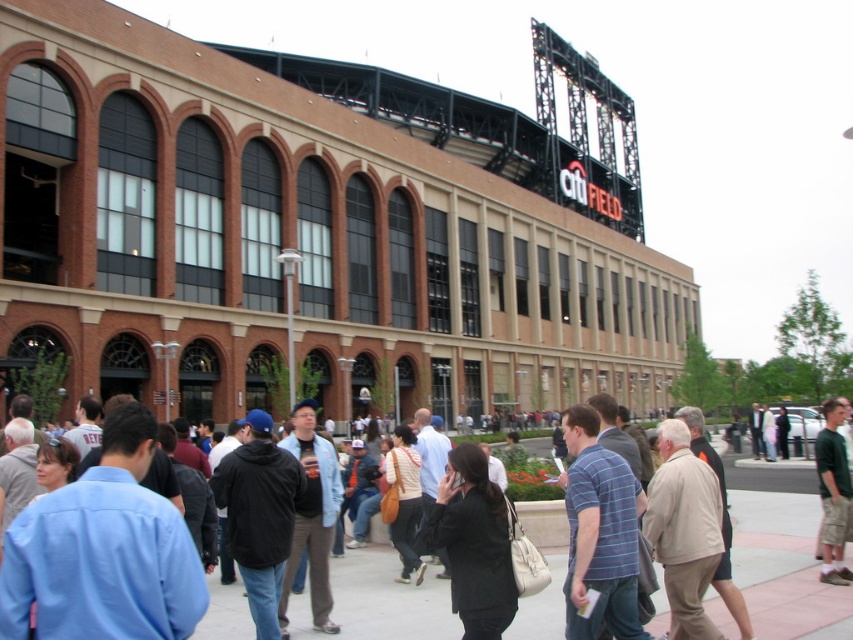
You are a photographer standing in front of the brown brick building at center and the green cotton shirt at right. You want to take a photo that includes both objects in the frame. Which object should you focus on first to ensure both are in the frame?

The brown brick building at center is located above the green cotton shirt at right, so you should focus on the brown brick building at center first to ensure both are in the frame.

You are standing in front of the stadium and want to locate the brown brick building at center. What are its coordinates?

The brown brick building at center is located at coordinates point (300,234).

In the scene shown: You are standing in front of Citi Field and want to take a photo that includes both the point at coordinates point (250, 324) and the point at coordinates point (831, 467). Which point should you focus on first to ensure both are in focus?

You should focus on the point (250, 324) first because it is closer to you than the point (831, 467), which is further away. This ensures the closer point is in focus, and the further point may still be within the depth of field.